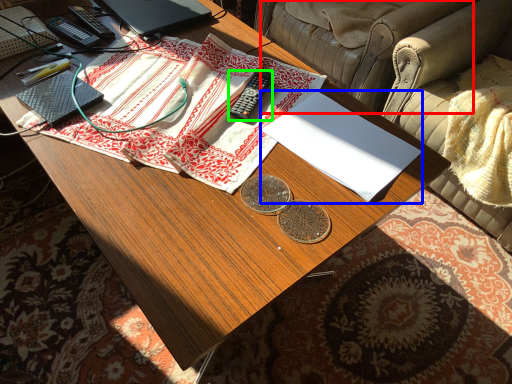
Question: Considering the real-world distances, which object is farthest from armchair (highlighted by a red box)? notebook (highlighted by a blue box) or remote control (highlighted by a green box)?

Choices:
 (A) notebook
 (B) remote control

Answer: (A)